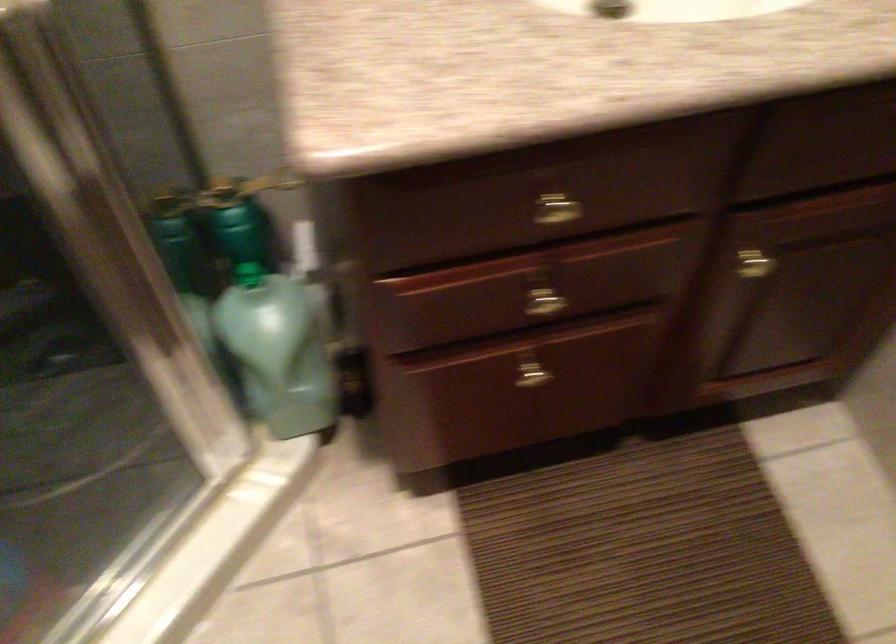
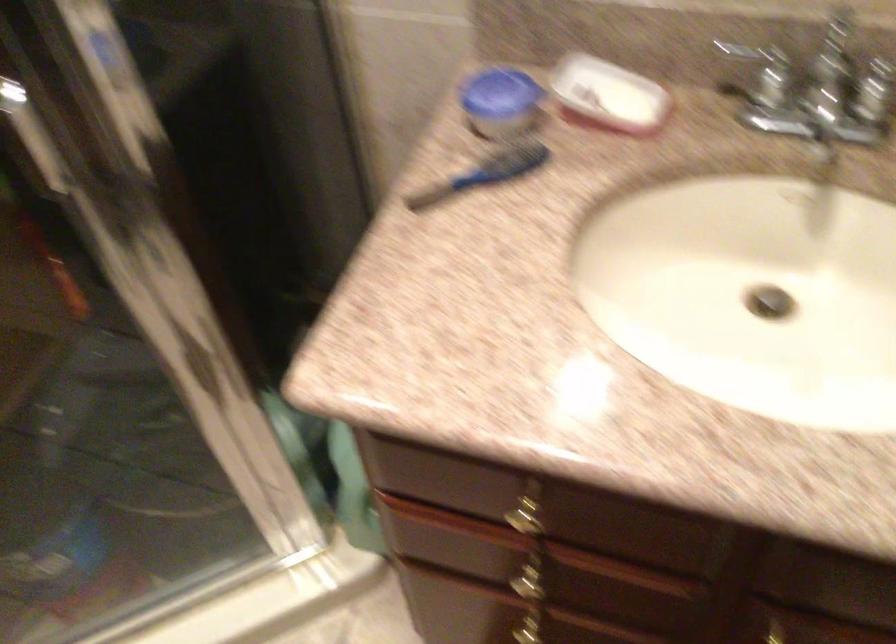
Question: The first image is from the beginning of the video and the second image is from the end. How did the camera likely rotate when shooting the video?

Choices:
 (A) Left
 (B) Right
 (C) Up
 (D) Down

Answer: (A)